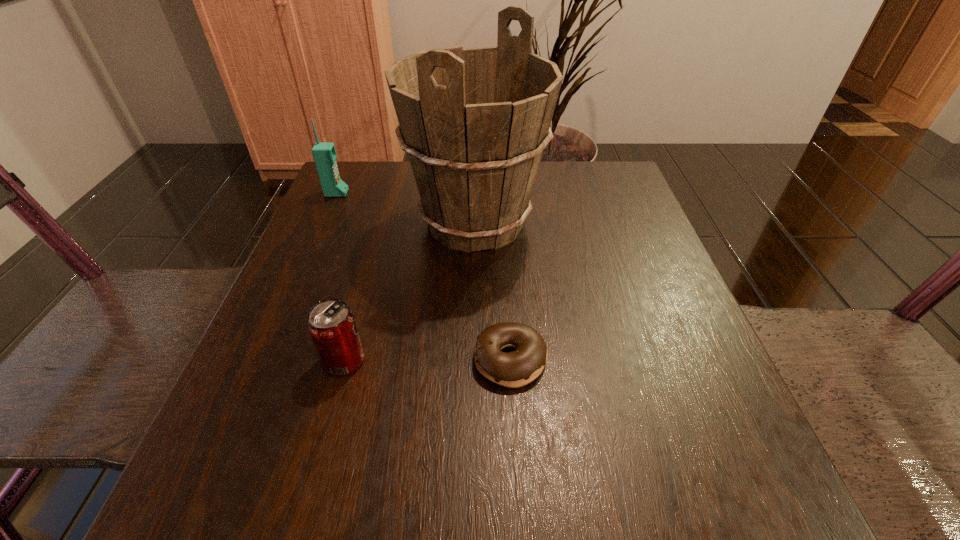
You are a GUI agent. You are given a task and a screenshot of the screen. Output one action in this format:
    pyautogui.click(x=<x>, y=<y>)
    Task: Click on the free area in between the bucket and the leftmost object
    The height and width of the screenshot is (540, 960).
    Given the screenshot: What is the action you would take?
    pyautogui.click(x=405, y=208)

Where is `blank region between the second object from left to right and the leftmost object`? blank region between the second object from left to right and the leftmost object is located at coordinates (340, 276).

This screenshot has width=960, height=540. In order to click on empty space between the cellular telephone and the bucket in this screenshot , I will do `click(405, 208)`.

You are a GUI agent. You are given a task and a screenshot of the screen. Output one action in this format:
    pyautogui.click(x=<x>, y=<y>)
    Task: Click on the vacant region between the bucket and the second shortest object
    The width and height of the screenshot is (960, 540).
    Given the screenshot: What is the action you would take?
    pyautogui.click(x=409, y=292)

I want to click on free space between the tallest object and the pop soda, so click(x=409, y=292).

The height and width of the screenshot is (540, 960). Identify the location of vacant space in between the tallest object and the pop soda. (409, 292).

This screenshot has height=540, width=960. In order to click on free spot between the second object from left to right and the tallest object in this screenshot , I will do 409,292.

This screenshot has height=540, width=960. In order to click on free point between the bucket and the shortest object in this screenshot , I will do `click(492, 292)`.

Locate an element on the screen. The image size is (960, 540). free space that is in between the bucket and the pop soda is located at coordinates (x=409, y=292).

Identify the location of blank region between the cellular telephone and the second shortest object. Image resolution: width=960 pixels, height=540 pixels. (340, 276).